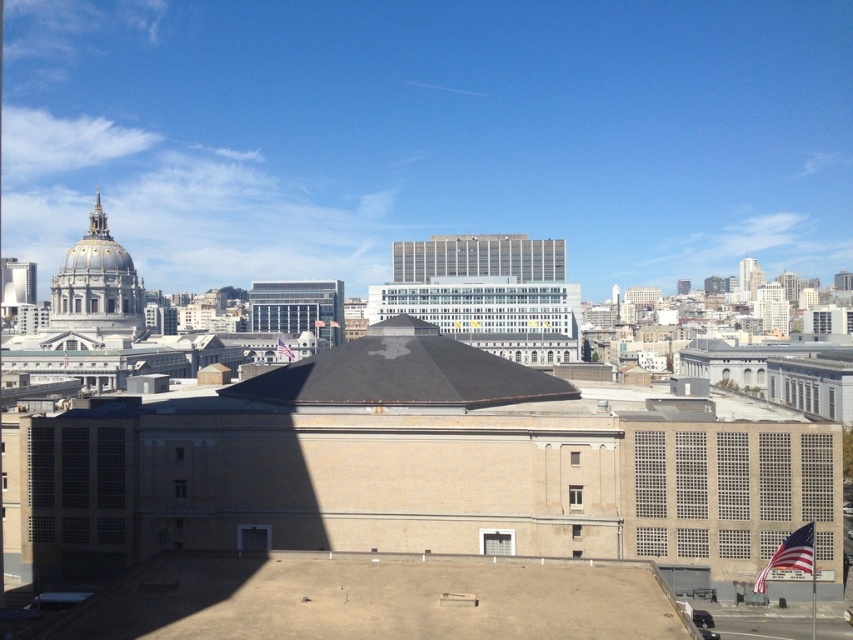
Question: Which of the following is the closest to the observer?

Choices:
 (A) (141, 296)
 (B) (469, 356)

Answer: (B)

Question: Does black matte roof at center appear over matte gray dome at upper left?

Choices:
 (A) no
 (B) yes

Answer: (A)

Question: Observing the image, what is the correct spatial positioning of black matte roof at center in reference to matte gray dome at upper left?

Choices:
 (A) below
 (B) above

Answer: (A)

Question: In this image, where is black matte roof at center located relative to matte gray dome at upper left?

Choices:
 (A) left
 (B) right

Answer: (B)

Question: Which point is closer to the camera?

Choices:
 (A) matte gray dome at upper left
 (B) black matte roof at center

Answer: (B)